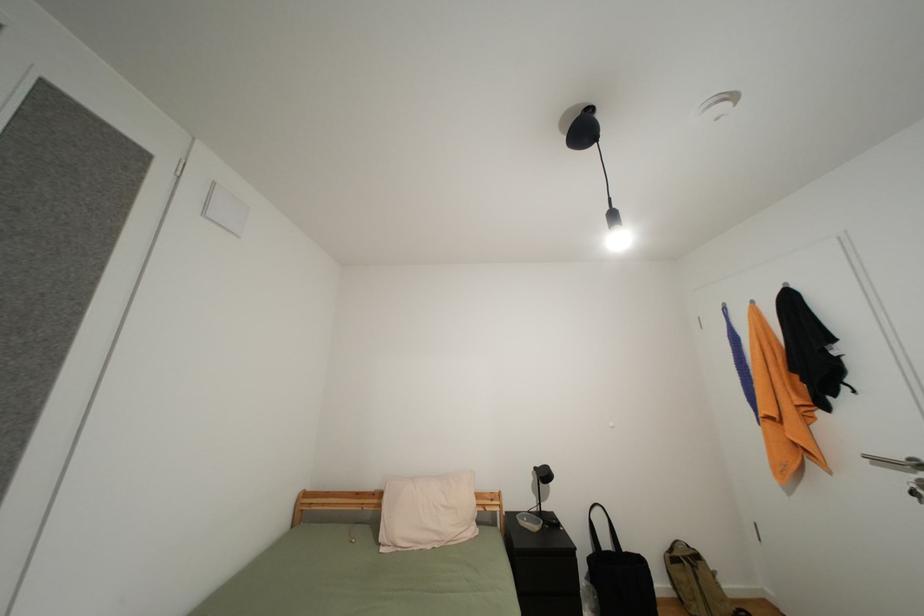
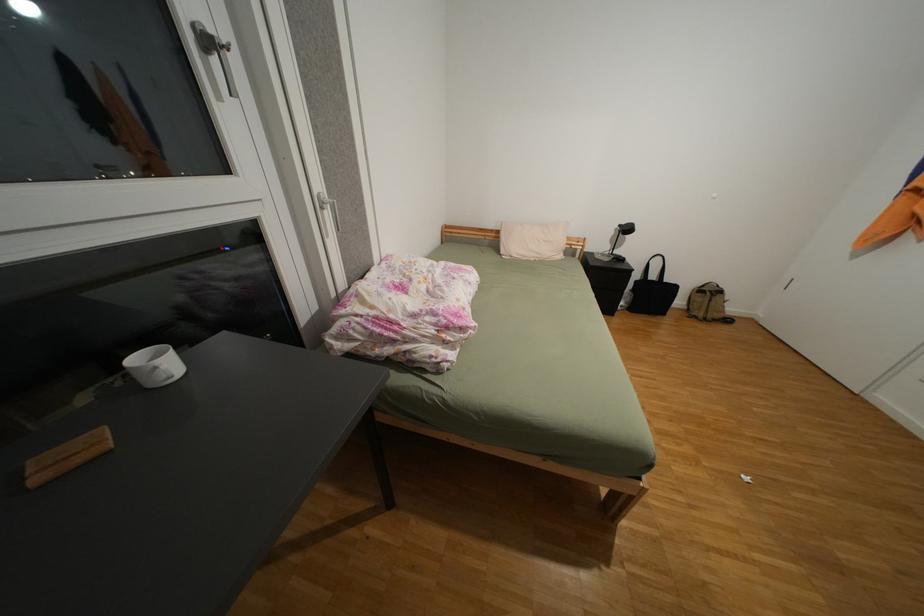
Based on the continuous images, in which direction is the camera rotating?

The rotation direction of the camera is left-down.